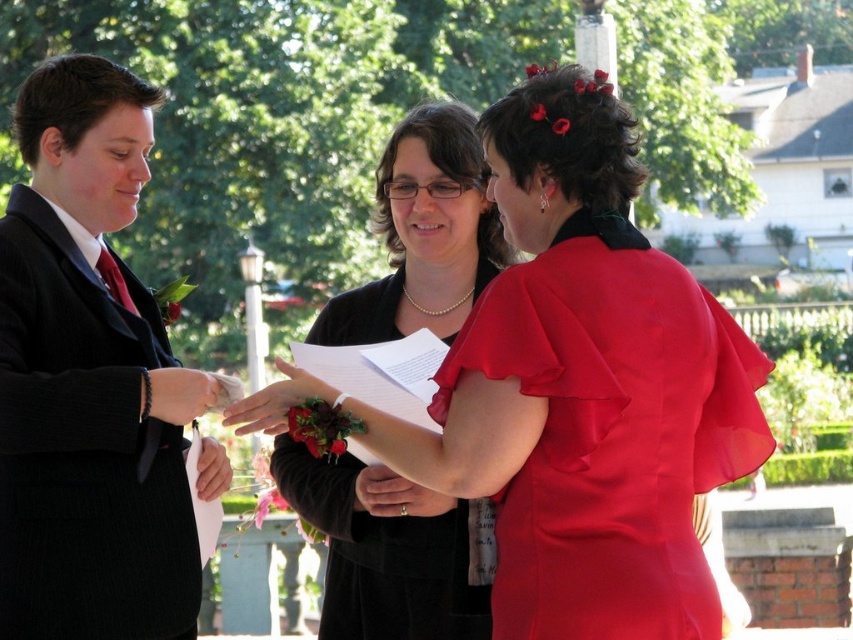
Looking at this image, can you confirm if matte black suit at left is positioned below satin red dress at center?

Actually, matte black suit at left is above satin red dress at center.

Is matte black suit at left above satin red dress at center?

Yes, matte black suit at left is above satin red dress at center.

Measure the distance between matte black suit at left and camera.

matte black suit at left and camera are 123.72 feet apart from each other.

In order to click on matte black suit at left in this screenshot , I will do `click(90, 380)`.

Is point (637, 552) more distant than point (451, 593)?

No, (637, 552) is in front of (451, 593).

How much distance is there between satin red dress at center and pearl necklace at center?

satin red dress at center and pearl necklace at center are 5.97 meters apart from each other.

You are a GUI agent. You are given a task and a screenshot of the screen. Output one action in this format:
    pyautogui.click(x=<x>, y=<y>)
    Task: Click on the satin red dress at center
    
    Given the screenshot: What is the action you would take?
    pyautogui.click(x=611, y=433)

Who is more distant from viewer, (105, 433) or (398, 180)?

The point (398, 180) is behind.

Does matte black suit at left appear on the right side of pearl necklace at center?

Incorrect, matte black suit at left is not on the right side of pearl necklace at center.

Who is more distant from viewer, (164, 493) or (450, 115)?

Point (450, 115)

You are a GUI agent. You are given a task and a screenshot of the screen. Output one action in this format:
    pyautogui.click(x=<x>, y=<y>)
    Task: Click on the matte black suit at left
    
    Given the screenshot: What is the action you would take?
    click(90, 380)